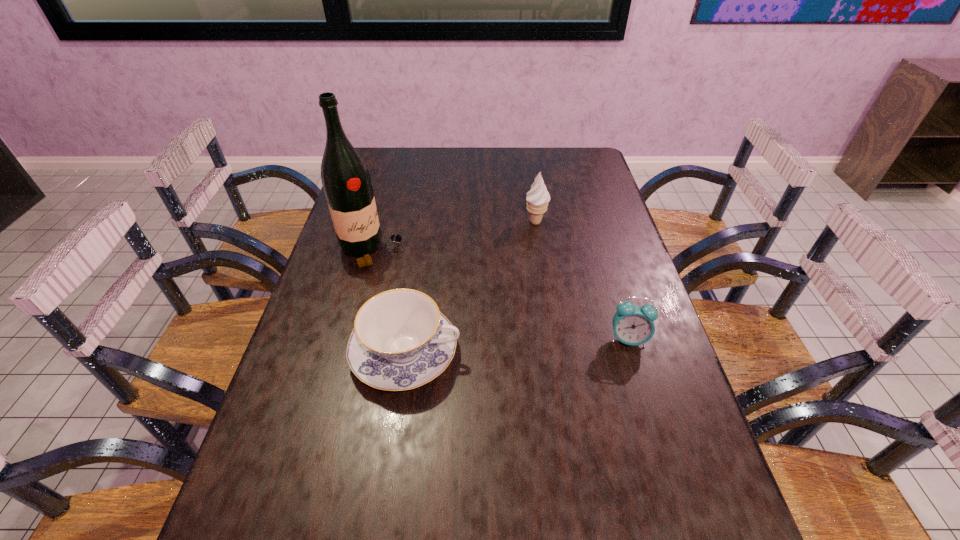
The height and width of the screenshot is (540, 960). I want to click on vacant space on the desktop that is between the chinaware and the alarm clock and is positioned on the surface of the wine bottle, so click(x=523, y=346).

Find the location of a particular element. free spot on the desktop that is between the chinaware and the rightmost object and is positioned on the front-facing side of the icecream is located at coordinates (534, 345).